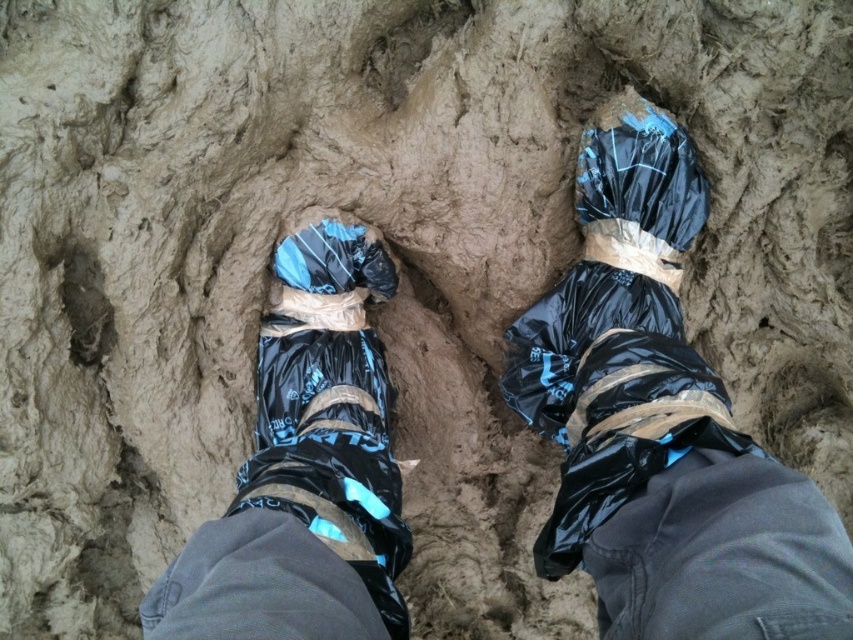
Question: Does black plastic boots at center lie behind black plastic bag at center?

Choices:
 (A) yes
 (B) no

Answer: (A)

Question: Can you confirm if black plastic boots at center is wider than black plastic bag at center?

Choices:
 (A) yes
 (B) no

Answer: (A)

Question: Which point is farther from the camera taking this photo?

Choices:
 (A) (686, 225)
 (B) (596, 202)

Answer: (A)

Question: Is black plastic boots at center below black plastic bag at center?

Choices:
 (A) yes
 (B) no

Answer: (B)

Question: Among these points, which one is farthest from the camera?

Choices:
 (A) (775, 588)
 (B) (618, 192)

Answer: (B)

Question: Which object appears farthest from the camera in this image?

Choices:
 (A) black plastic bag at center
 (B) black plastic boots at center

Answer: (B)